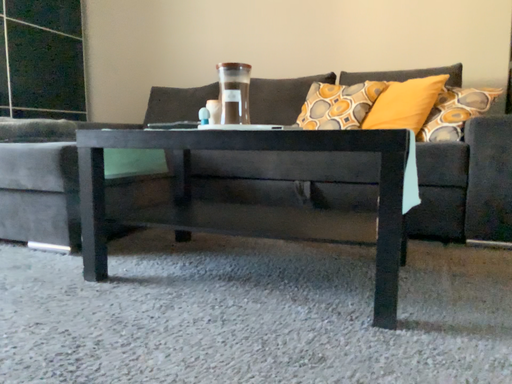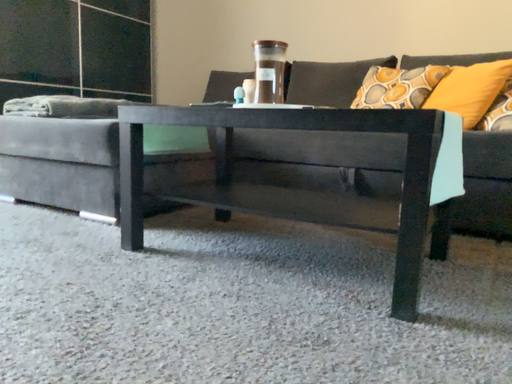
Question: How did the camera likely rotate when shooting the video?

Choices:
 (A) rotated left
 (B) rotated right

Answer: (A)